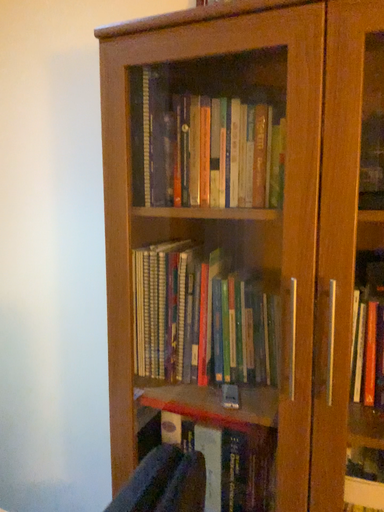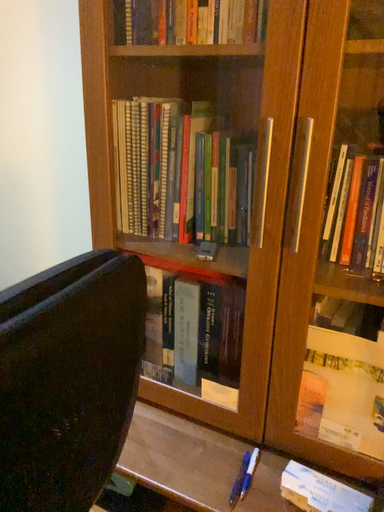
Question: How did the camera likely rotate when shooting the video?

Choices:
 (A) rotated upward
 (B) rotated downward

Answer: (B)